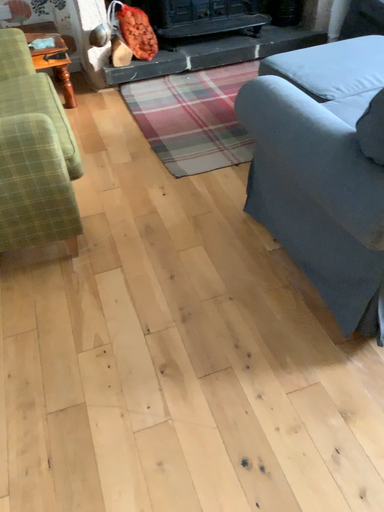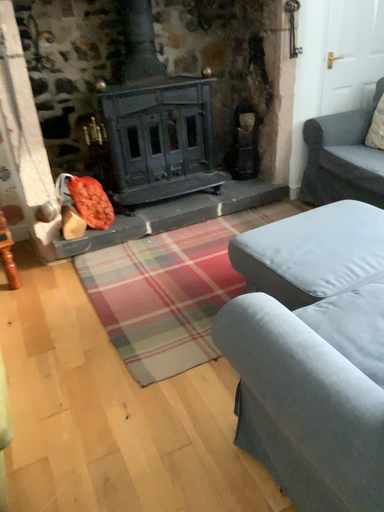
Question: How did the camera likely rotate when shooting the video?

Choices:
 (A) rotated upward
 (B) rotated downward

Answer: (A)